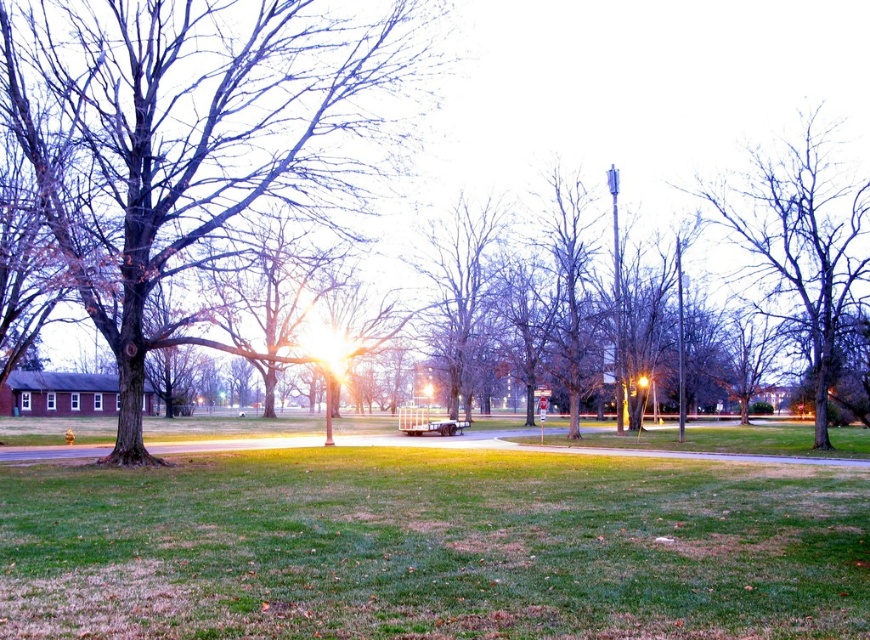
You are standing in the park and see two points marked in the image. The first point is at coordinates point(x=808, y=620) and the second is at point(x=293, y=115). Which point is closer to you?

Point(x=808, y=620) is in front of point(x=293, y=115), so it is closer to you.

You are standing in the park and want to walk from the bare wood tree at upper right to the bare wood tree at center. Which direction should you face to walk directly towards the second tree?

You should face away from the direction of the horizon with orange tinge because the bare wood tree at upper right is closer to you than the bare wood tree at center, so the center tree is behind you relative to the upper right tree.